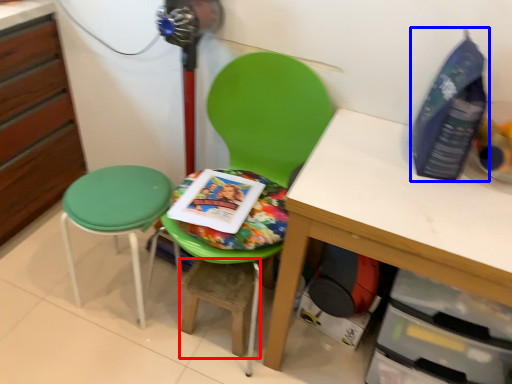
Question: Which object appears farthest to the camera in this image, step stool (highlighted by a red box) or bottle (highlighted by a blue box)?

Choices:
 (A) step stool
 (B) bottle

Answer: (A)